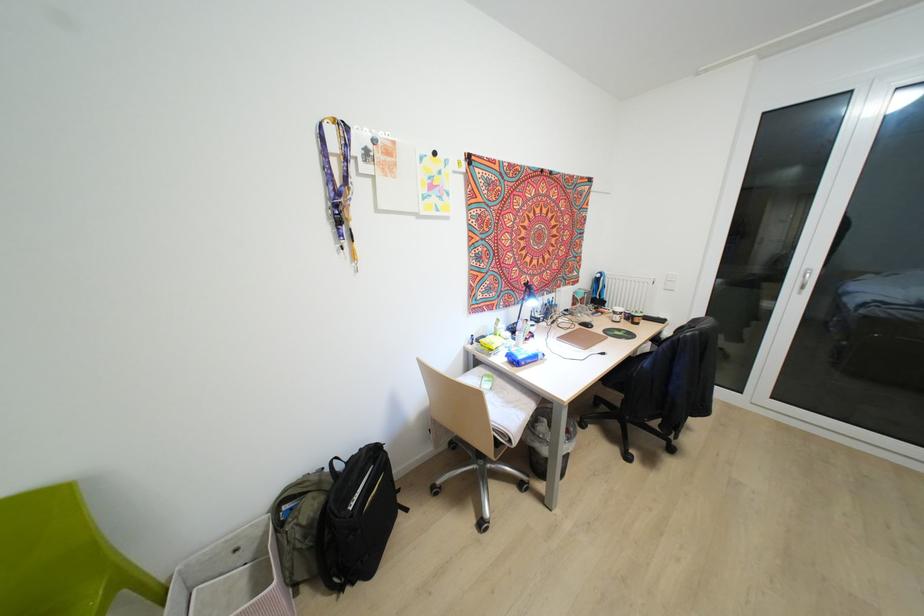
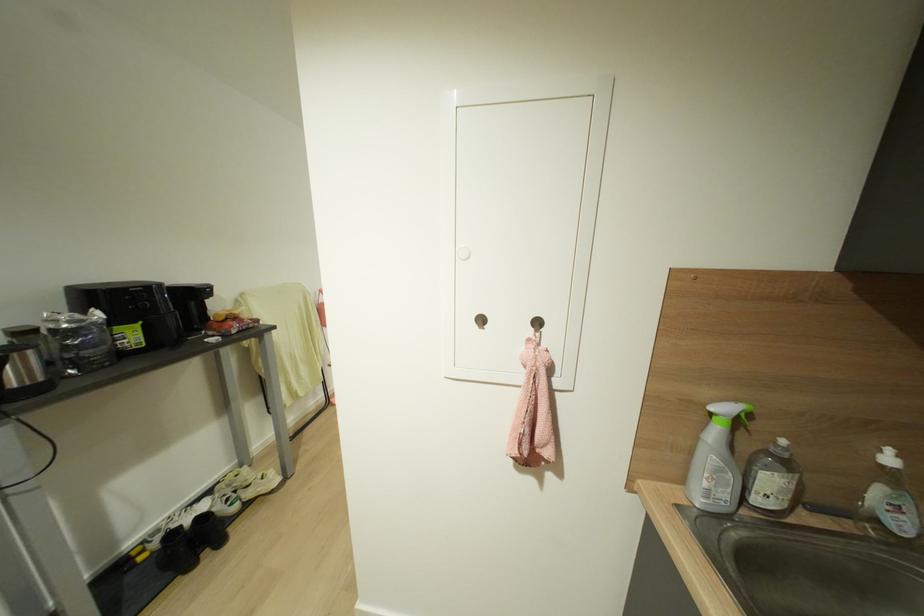
Question: I am providing you with two images of the same scene from different viewpoints. After the viewpoint changes to image2, which objects are now occluded?

Choices:
 (A) black backpack
 (B) grey keypad button
 (C) white sneaker
 (D) silver electric kettle

Answer: (A)